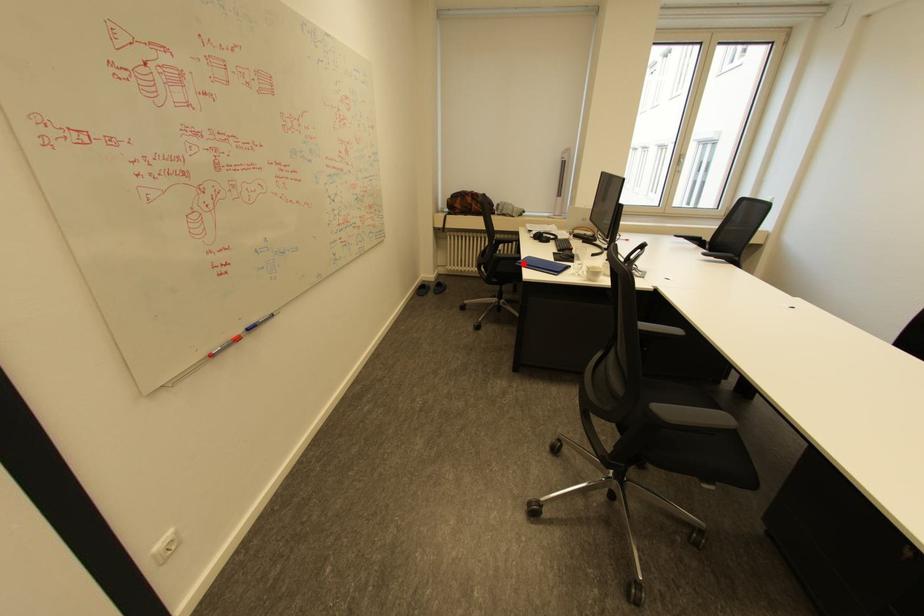
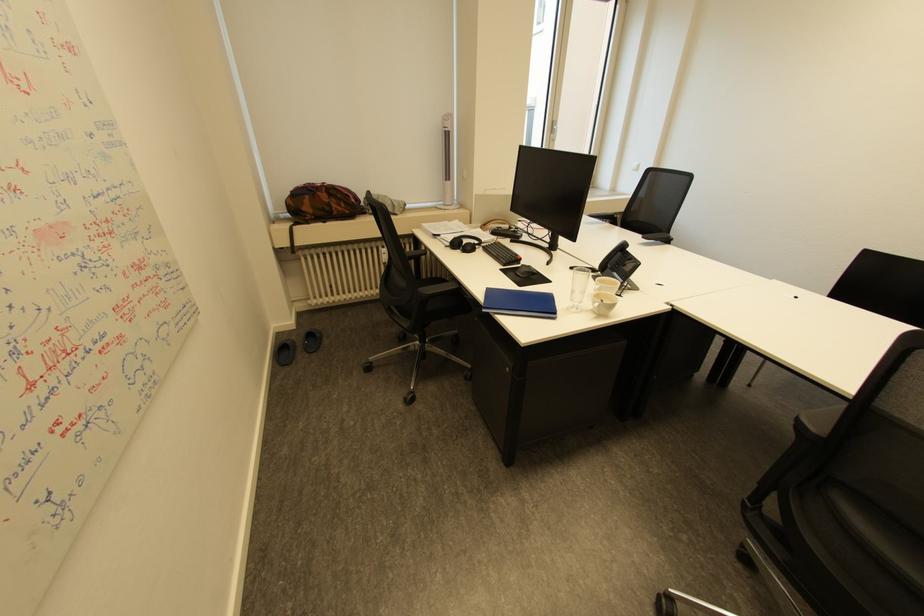
Locate, in the second image, the point that corresponds to the highlighted location in the first image.

(491, 310)